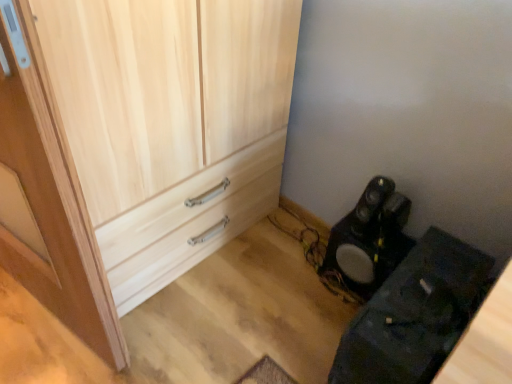
Find the location of a particular element. vacant area that lies to the right of wooden door at left is located at coordinates click(203, 315).